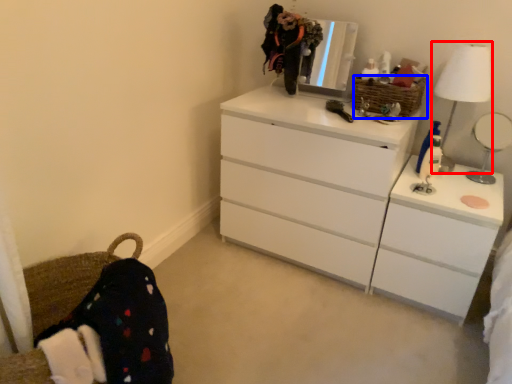
Question: Which object appears closest to the camera in this image, table lamp (highlighted by a red box) or basket (highlighted by a blue box)?

Choices:
 (A) table lamp
 (B) basket

Answer: (A)